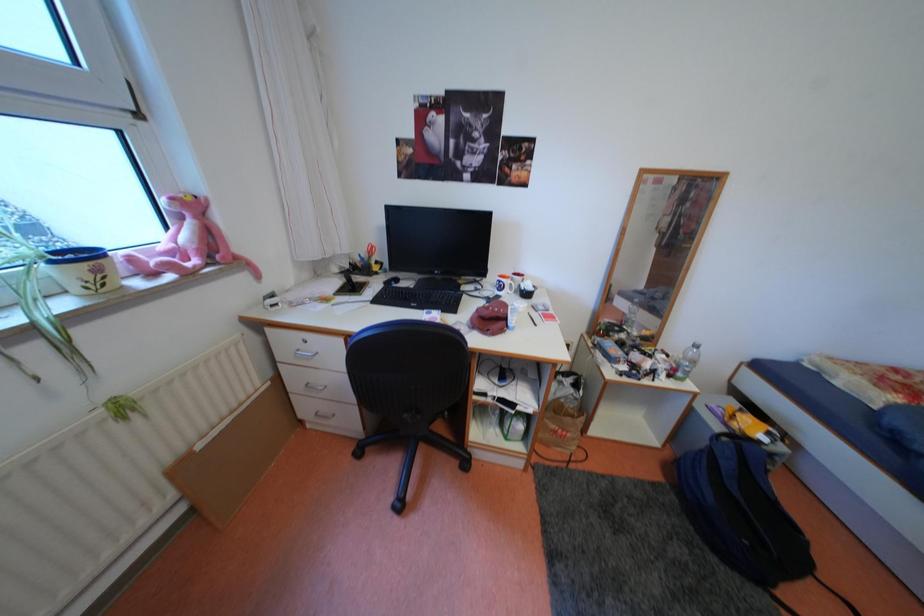
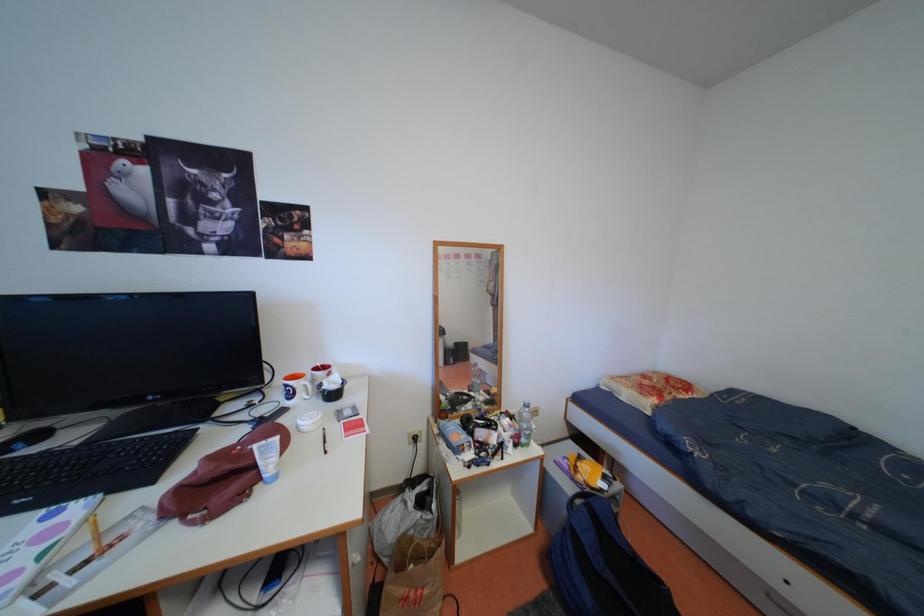
Question: The camera is either moving clockwise (left) or counter-clockwise (right) around the object. The first image is from the beginning of the video and the second image is from the end. Is the camera moving left or right when shooting the video?

Choices:
 (A) Left
 (B) Right

Answer: (A)